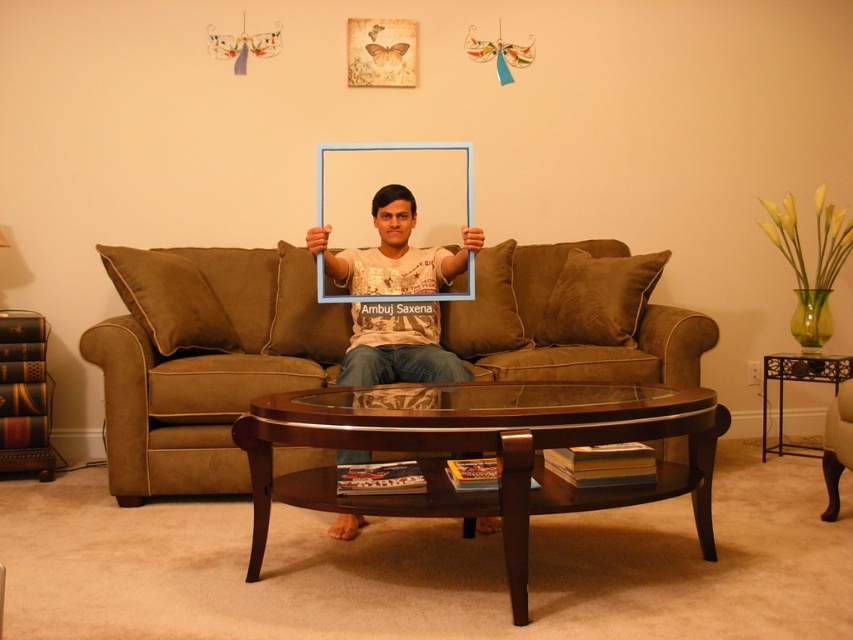
Does brown suede couch at center have a lesser height compared to blue plastic picture frame at center?

Incorrect, brown suede couch at center's height does not fall short of blue plastic picture frame at center's.

Which is in front, point (279, 307) or point (469, 266)?

Point (469, 266)

Which is in front, point (207, 280) or point (460, 170)?

Point (207, 280) is more forward.

At what (x,y) coordinates should I click in order to perform the action: click on brown suede couch at center. Please return your answer as a coordinate pair (x, y). The width and height of the screenshot is (853, 640). Looking at the image, I should click on (210, 372).

Which is behind, point (204, 464) or point (486, 525)?

Positioned behind is point (204, 464).

Is brown suede couch at center above matte white t-shirt at center?

Incorrect, brown suede couch at center is not positioned above matte white t-shirt at center.

Does point (207, 282) come farther from viewer compared to point (422, 365)?

That is True.

I want to click on brown suede couch at center, so click(210, 372).

Is matte white t-shirt at center bigger than blue plastic picture frame at center?

Correct, matte white t-shirt at center is larger in size than blue plastic picture frame at center.

Does point (444, 250) lie behind point (328, 152)?

No, (444, 250) is in front of (328, 152).

This screenshot has height=640, width=853. I want to click on matte white t-shirt at center, so click(x=393, y=250).